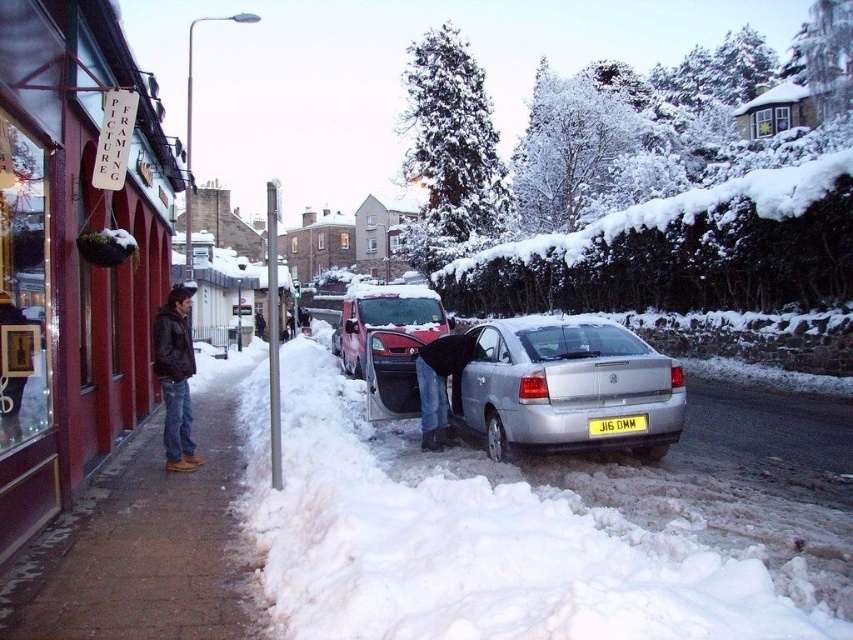
Can you confirm if brown brick pavement at lower left is thinner than dark brown leather jacket at left?

No.

Does brown brick pavement at lower left have a smaller size compared to dark brown leather jacket at left?

Actually, brown brick pavement at lower left might be larger than dark brown leather jacket at left.

Who is more forward, (160, 496) or (190, 369)?

Point (160, 496)

I want to click on brown brick pavement at lower left, so click(144, 540).

Image resolution: width=853 pixels, height=640 pixels. What are the coordinates of `white fluffy snow at lower center` in the screenshot? It's located at (471, 548).

Can you confirm if white fluffy snow at lower center is smaller than brown brick pavement at lower left?

Actually, white fluffy snow at lower center might be larger than brown brick pavement at lower left.

What do you see at coordinates (471, 548) in the screenshot? I see `white fluffy snow at lower center` at bounding box center [471, 548].

Where is `white fluffy snow at lower center`? white fluffy snow at lower center is located at coordinates (471, 548).

Who is taller, white fluffy snow at lower center or matte black sign at center?

white fluffy snow at lower center

Can you confirm if white fluffy snow at lower center is positioned to the right of matte black sign at center?

Yes, white fluffy snow at lower center is to the right of matte black sign at center.

Measure the distance between point [270,595] and camera.

4.44 meters

Where is `white fluffy snow at lower center`? white fluffy snow at lower center is located at coordinates (471, 548).